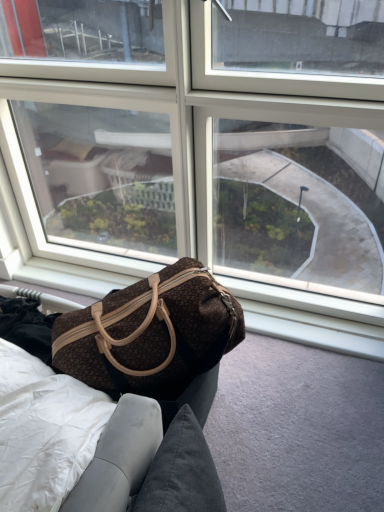
In order to click on free space above brown fabric bag at lower left (from a real-world perspective) in this screenshot , I will do `click(271, 421)`.